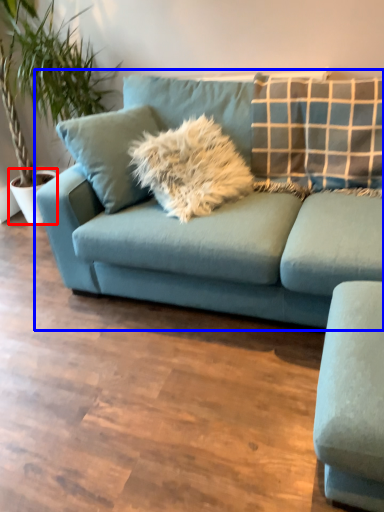
Question: Which of the following is the closest to the observer, flowerpot (highlighted by a red box) or studio couch (highlighted by a blue box)?

Choices:
 (A) flowerpot
 (B) studio couch

Answer: (B)